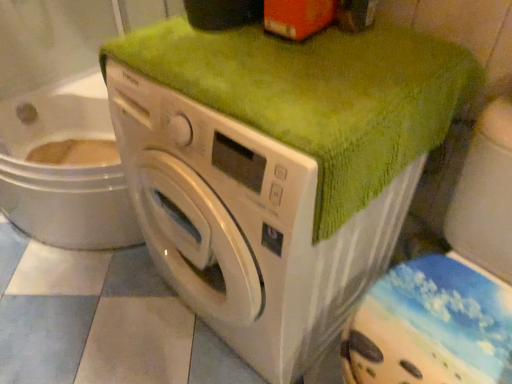
Question: Does green textured towel at upper center have a lesser height compared to white glossy washing machine at center?

Choices:
 (A) no
 (B) yes

Answer: (B)

Question: Considering the relative sizes of green textured towel at upper center and white glossy washing machine at center in the image provided, is green textured towel at upper center thinner than white glossy washing machine at center?

Choices:
 (A) no
 (B) yes

Answer: (B)

Question: Is green textured towel at upper center wider than white glossy washing machine at center?

Choices:
 (A) no
 (B) yes

Answer: (A)

Question: Is there a large distance between green textured towel at upper center and white glossy washing machine at center?

Choices:
 (A) yes
 (B) no

Answer: (B)

Question: Can we say green textured towel at upper center lies outside white glossy washing machine at center?

Choices:
 (A) yes
 (B) no

Answer: (B)

Question: Is green textured towel at upper center in contact with white glossy washing machine at center?

Choices:
 (A) yes
 (B) no

Answer: (B)

Question: From the image's perspective, is green fabric-covered washer at right located above white glossy washing machine at center?

Choices:
 (A) no
 (B) yes

Answer: (A)

Question: Can you confirm if green fabric-covered washer at right is shorter than white glossy washing machine at center?

Choices:
 (A) yes
 (B) no

Answer: (A)

Question: Considering the relative sizes of green fabric-covered washer at right and white glossy washing machine at center in the image provided, is green fabric-covered washer at right thinner than white glossy washing machine at center?

Choices:
 (A) no
 (B) yes

Answer: (B)

Question: Can you confirm if green fabric-covered washer at right is taller than white glossy washing machine at center?

Choices:
 (A) no
 (B) yes

Answer: (A)

Question: Can we say green fabric-covered washer at right lies outside white glossy washing machine at center?

Choices:
 (A) yes
 (B) no

Answer: (A)

Question: From the image's perspective, is green fabric-covered washer at right located beneath white glossy washing machine at center?

Choices:
 (A) no
 (B) yes

Answer: (B)

Question: Considering the relative sizes of green textured towel at upper center and green fabric-covered washer at right in the image provided, is green textured towel at upper center taller than green fabric-covered washer at right?

Choices:
 (A) yes
 (B) no

Answer: (B)